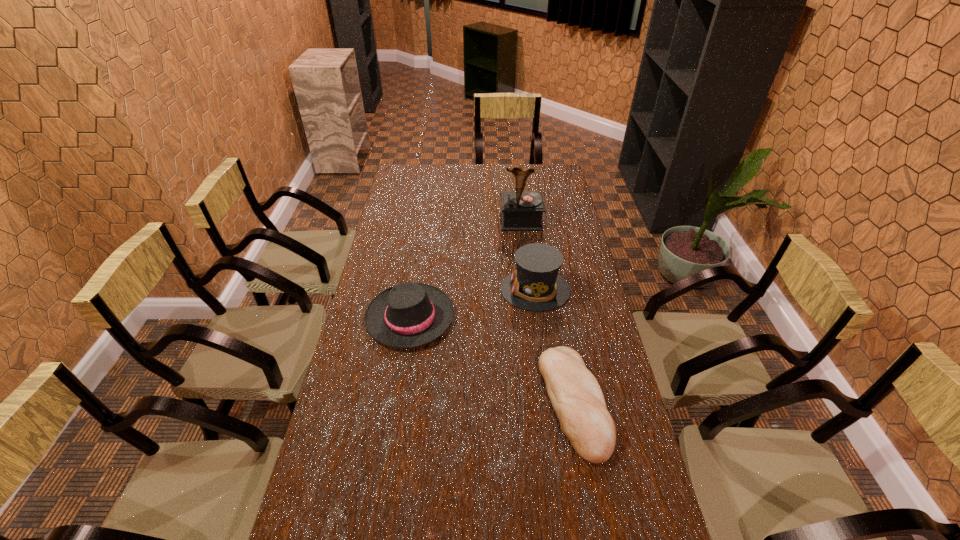
This screenshot has width=960, height=540. I want to click on the farthest object, so click(x=522, y=210).

The height and width of the screenshot is (540, 960). I want to click on phonograph_record, so click(x=522, y=210).

Where is `the third shortest object`? Image resolution: width=960 pixels, height=540 pixels. the third shortest object is located at coordinates pyautogui.click(x=536, y=285).

The image size is (960, 540). I want to click on the taller dress hat, so click(x=536, y=285).

This screenshot has height=540, width=960. I want to click on the left dress hat, so click(x=408, y=315).

I want to click on the second shortest object, so click(408, 315).

The width and height of the screenshot is (960, 540). In order to click on the shortest object in this screenshot , I will do `click(577, 399)`.

Identify the location of free space located 0.220m at the horn opening of the tallest object. [x=526, y=265].

At what (x,y) coordinates should I click in order to perform the action: click on free spot located 0.090m with goggles on the front of the third shortest object. Please return your answer as a coordinate pair (x, y). The image size is (960, 540). Looking at the image, I should click on (475, 290).

Locate an element on the screen. The image size is (960, 540). free spot located with goggles on the front of the third shortest object is located at coordinates (392, 290).